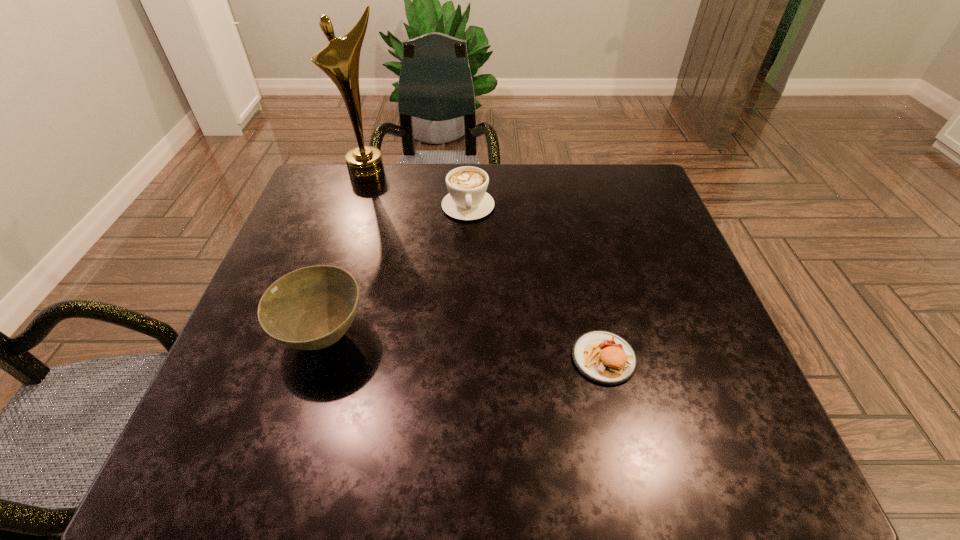
Where is `award that is at the left edge`? award that is at the left edge is located at coordinates (339, 59).

Identify the location of object that is at the far left corner. (339, 59).

The height and width of the screenshot is (540, 960). Identify the location of object located at the near left corner. (311, 308).

Find the location of a particular element. This screenshot has width=960, height=540. vacant space at the far edge of the desktop is located at coordinates (487, 190).

Identify the location of vacant space at the near edge of the desktop. This screenshot has height=540, width=960. (538, 377).

This screenshot has height=540, width=960. What are the coordinates of `vacant point at the left edge` in the screenshot? It's located at (247, 330).

The image size is (960, 540). In the image, there is a desktop. Identify the location of vacant space at the right edge. (637, 219).

Locate an element on the screen. Image resolution: width=960 pixels, height=540 pixels. vacant space at the far left corner of the desktop is located at coordinates (345, 202).

Locate an element on the screen. free space at the far right corner of the desktop is located at coordinates (642, 214).

In the image, there is a desktop. Where is `vacant space at the near right corner`? vacant space at the near right corner is located at coordinates (680, 382).